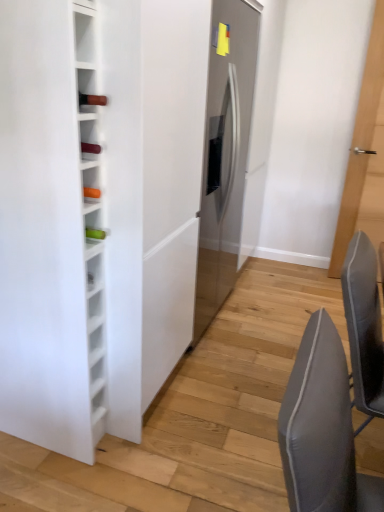
Question: Visually, is light brown wooden door at right positioned to the left or to the right of gray fabric chair at lower right?

Choices:
 (A) left
 (B) right

Answer: (B)

Question: From the image's perspective, is light brown wooden door at right positioned above or below gray fabric chair at lower right?

Choices:
 (A) above
 (B) below

Answer: (A)

Question: Which object is the farthest from the gray fabric chair at lower right?

Choices:
 (A) white glass wine rack at left
 (B) light brown wooden door at right
 (C) satin silver refrigerator at center

Answer: (B)

Question: Based on their relative distances, which object is nearer to the gray fabric chair at lower right?

Choices:
 (A) light brown wooden door at right
 (B) satin silver refrigerator at center
 (C) white glass wine rack at left

Answer: (C)